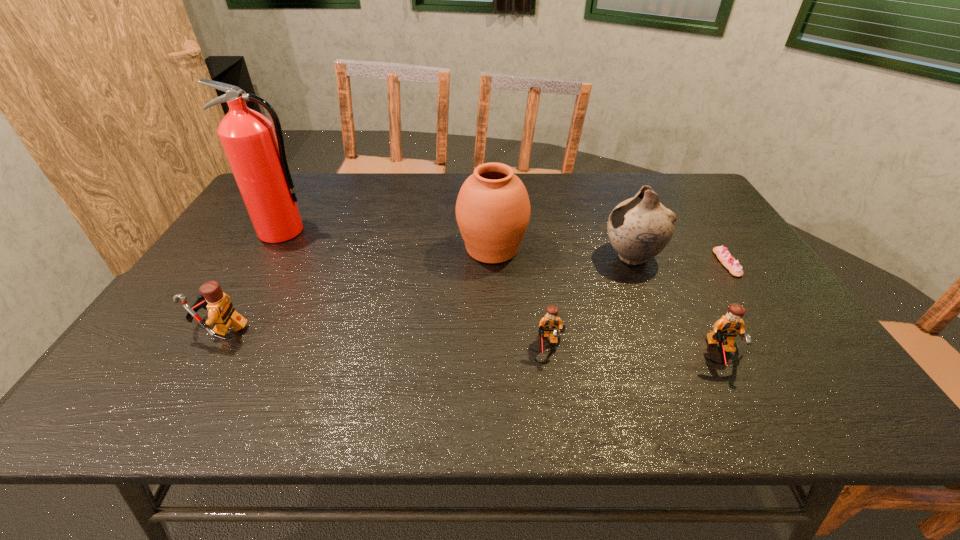
Please mark a free spot for a new Lego to balance the arrangement. Please provide its 2D coordinates. Your answer should be formatted as a tuple, i.e. [(x, y)], where the tuple contains the x and y coordinates of a point satisfying the conditions above.

[(380, 337)]